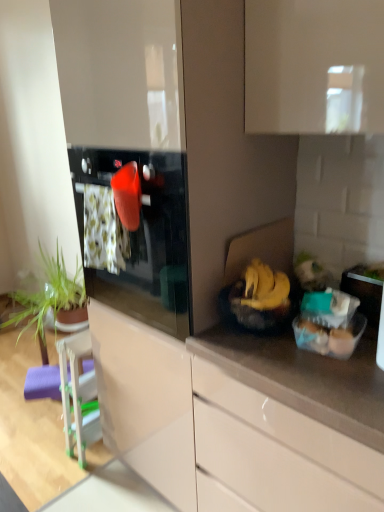
The image size is (384, 512). In order to click on unoccupied area in front of translucent plastic eggs at right in this screenshot , I will do `click(336, 376)`.